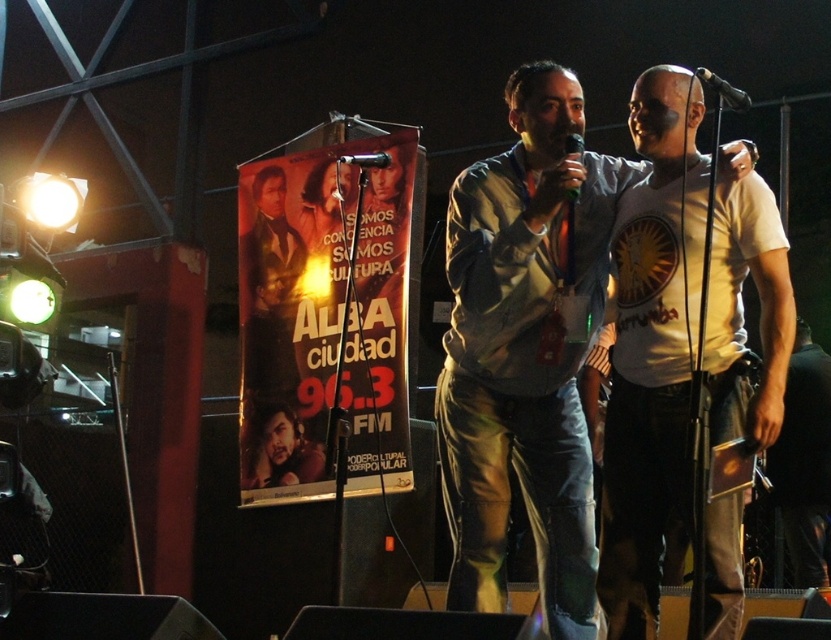
Is white cotton t-shirt at center in front of black plastic microphone at center?

Yes.

Does white cotton t-shirt at center appear over black plastic microphone at center?

Actually, white cotton t-shirt at center is below black plastic microphone at center.

You are a GUI agent. You are given a task and a screenshot of the screen. Output one action in this format:
    pyautogui.click(x=<x>, y=<y>)
    Task: Click on the white cotton t-shirt at center
    
    Given the screenshot: What is the action you would take?
    pyautogui.click(x=652, y=348)

Does matte paper poster at center have a lesser width compared to black matte microphone at center?

No, matte paper poster at center is not thinner than black matte microphone at center.

Is matte paper poster at center below black matte microphone at center?

Yes, matte paper poster at center is below black matte microphone at center.

The image size is (831, 640). Find the location of `matte paper poster at center`. matte paper poster at center is located at coordinates (323, 317).

Locate an element on the screen. matte paper poster at center is located at coordinates pos(323,317).

Who is taller, white cotton t-shirt at center or black metallic microphone at upper right?

white cotton t-shirt at center

Can you confirm if white cotton t-shirt at center is taller than black metallic microphone at upper right?

Indeed, white cotton t-shirt at center has a greater height compared to black metallic microphone at upper right.

Where is `white cotton t-shirt at center`? The width and height of the screenshot is (831, 640). white cotton t-shirt at center is located at coordinates (652, 348).